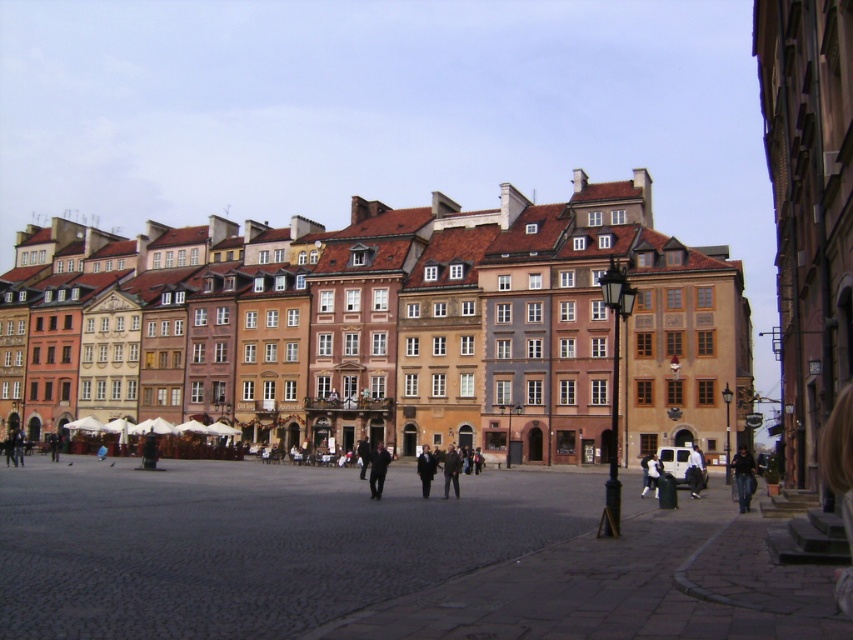
Is dark blue jacket at center smaller than dark gray jacket at center?

Actually, dark blue jacket at center might be larger than dark gray jacket at center.

Which is behind, point (370, 458) or point (451, 454)?

Point (370, 458)

Which is in front, point (370, 486) or point (454, 458)?

Point (370, 486)

Where is `dark blue jacket at center`? The width and height of the screenshot is (853, 640). dark blue jacket at center is located at coordinates (378, 468).

Find the location of `dark blue jacket at center`. dark blue jacket at center is located at coordinates (378, 468).

How far apart are dark blue jacket at center and white cotton shirt at lower right?

The distance of dark blue jacket at center from white cotton shirt at lower right is 19.36 meters.

The height and width of the screenshot is (640, 853). Find the location of `dark blue jacket at center`. dark blue jacket at center is located at coordinates (378, 468).

Does matte brown building at center have a lesser width compared to dark blue jacket at center?

No.

Does matte brown building at center have a greater width compared to dark blue jacket at center?

Yes.

Is point (654, 301) positioned before point (387, 456)?

No, it is not.

Where is `matte brown building at center`? This screenshot has height=640, width=853. matte brown building at center is located at coordinates (398, 328).